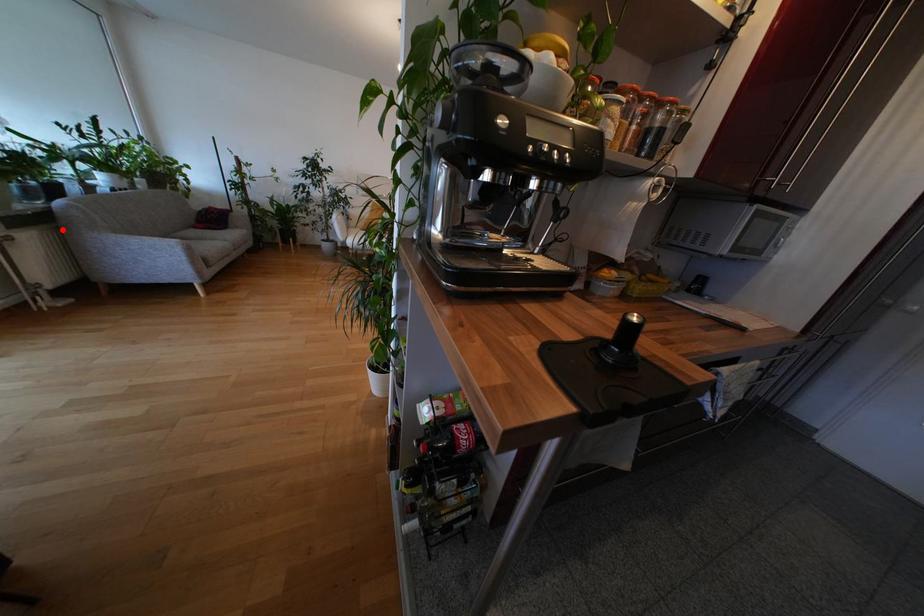
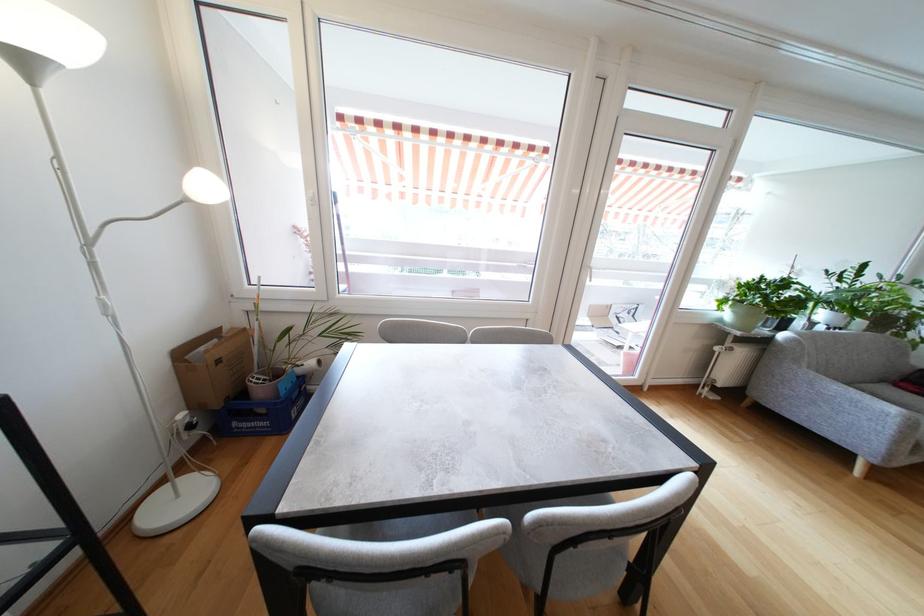
Question: I am providing you with two images of the same scene from different viewpoints. Image1 has a red point marked. In image2, the corresponding 3D location appears at what relative position? Reply with the corresponding letter.

Choices:
 (A) Closer
 (B) Farther

Answer: (A)